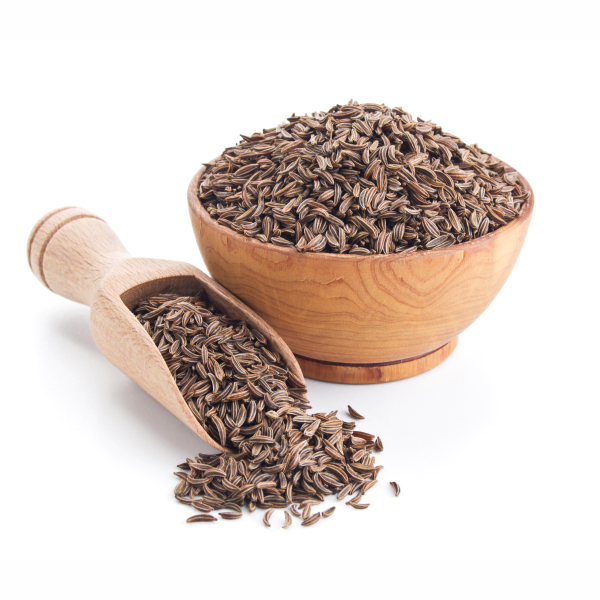
This screenshot has width=600, height=600. Find the location of `wooden bowl`. wooden bowl is located at coordinates (346, 302).